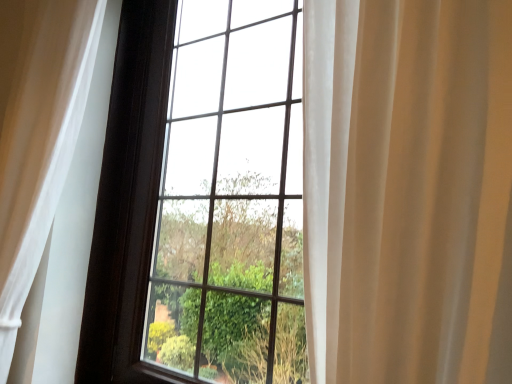
Question: From a real-world perspective, is white sheer curtain at left above or below transparent glass window at center?

Choices:
 (A) above
 (B) below

Answer: (B)

Question: Based on their sizes in the image, would you say white sheer curtain at left is bigger or smaller than transparent glass window at center?

Choices:
 (A) small
 (B) big

Answer: (A)

Question: Is white sheer curtain at left wider or thinner than transparent glass window at center?

Choices:
 (A) thin
 (B) wide

Answer: (B)

Question: Based on their sizes in the image, would you say transparent glass window at center is bigger or smaller than white sheer curtain at left?

Choices:
 (A) small
 (B) big

Answer: (B)

Question: From the image's perspective, is transparent glass window at center above or below white sheer curtain at left?

Choices:
 (A) below
 (B) above

Answer: (A)

Question: Is transparent glass window at center in front of or behind white sheer curtain at left in the image?

Choices:
 (A) behind
 (B) front

Answer: (B)

Question: Would you say transparent glass window at center is inside or outside white sheer curtain at left?

Choices:
 (A) outside
 (B) inside

Answer: (A)